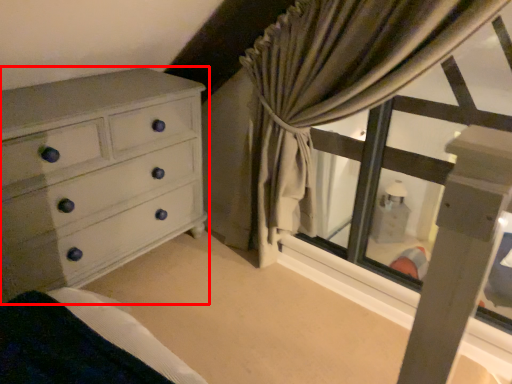
Question: From the image, what is the correct spatial relationship of chest of drawers (annotated by the red box) in relation to curtain?

Choices:
 (A) left
 (B) right

Answer: (A)